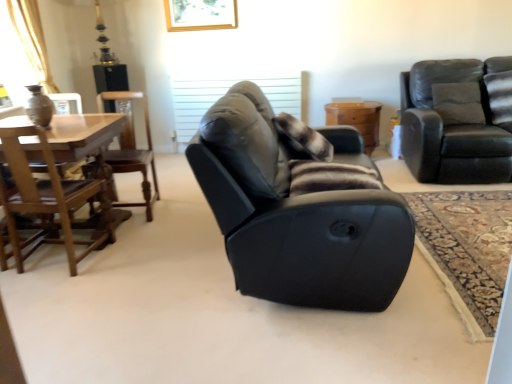
Where is `vacant area situated to the left side of black leather recliner at center, the 3th chair in the left-to-right sequence`? vacant area situated to the left side of black leather recliner at center, the 3th chair in the left-to-right sequence is located at coordinates (121, 277).